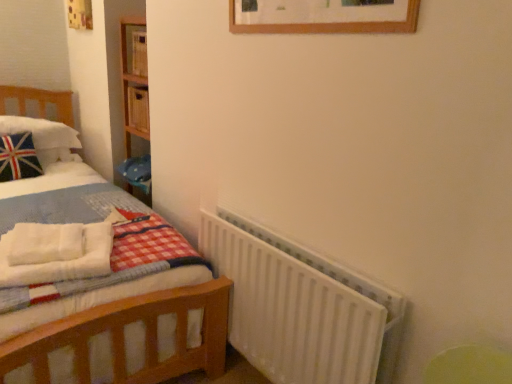
Question: Is point (0, 246) closer or farther from the camera than point (1, 125)?

Choices:
 (A) farther
 (B) closer

Answer: (B)

Question: From their relative heights in the image, would you say white fluffy blanket at left is taller or shorter than white plush pillow at left?

Choices:
 (A) tall
 (B) short

Answer: (B)

Question: Considering the real-world distances, which object is farthest from the white fluffy blanket at left?

Choices:
 (A) white plush pillow at left
 (B) white matte radiator at lower right

Answer: (A)

Question: Based on their relative distances, which object is nearer to the white fluffy blanket at left?

Choices:
 (A) white matte radiator at lower right
 (B) white plush pillow at left

Answer: (A)